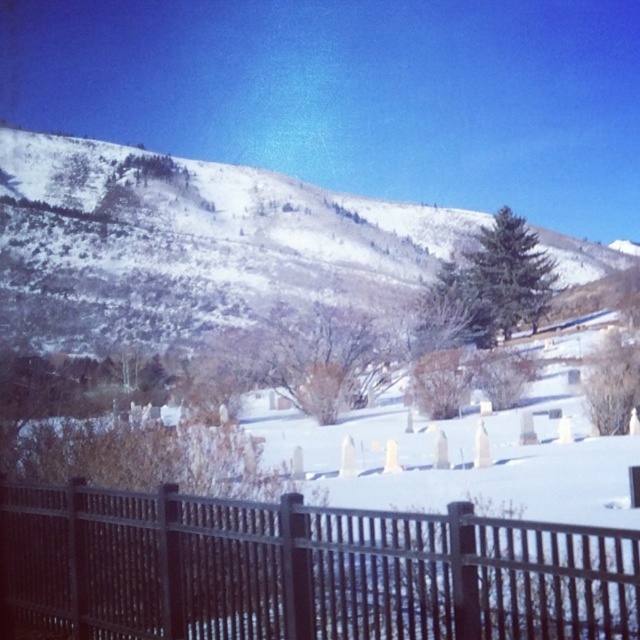
Does black metal fence at lower center appear over snowy textured hillside at upper center?

No, black metal fence at lower center is not above snowy textured hillside at upper center.

At what (x,y) coordinates should I click in order to perform the action: click on black metal fence at lower center. Please return your answer as a coordinate pair (x, y). The image size is (640, 640). Looking at the image, I should click on (300, 570).

Who is more distant from viewer, [88,616] or [84,218]?

Point [84,218]

Locate an element on the screen. This screenshot has width=640, height=640. black metal fence at lower center is located at coordinates (300, 570).